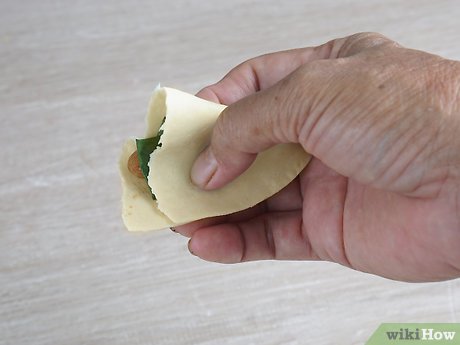
Locate an element on the screen. floor is located at coordinates (93, 260).